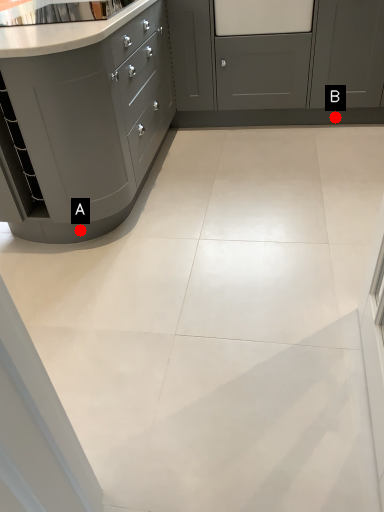
Question: Two points are circled on the image, labeled by A and B beside each circle. Which point is closer to the camera taking this photo?

Choices:
 (A) A is closer
 (B) B is closer

Answer: (A)